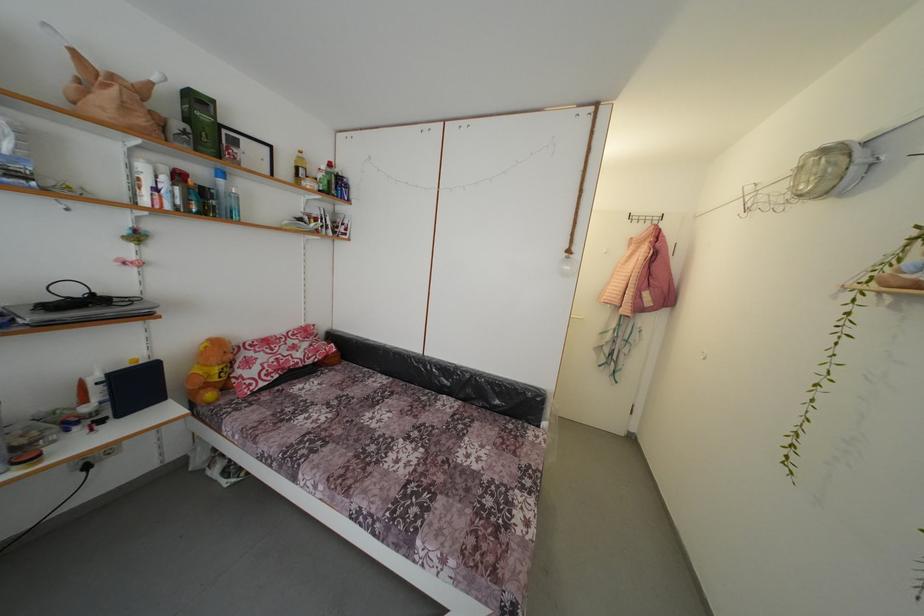
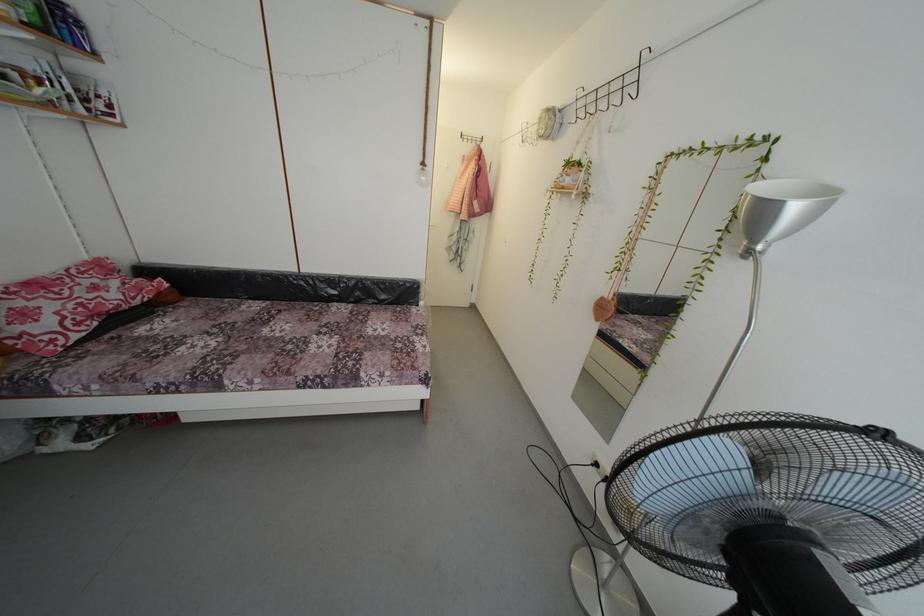
The point at (574, 257) is marked in the first image. Where is the corresponding point in the second image?

(429, 169)